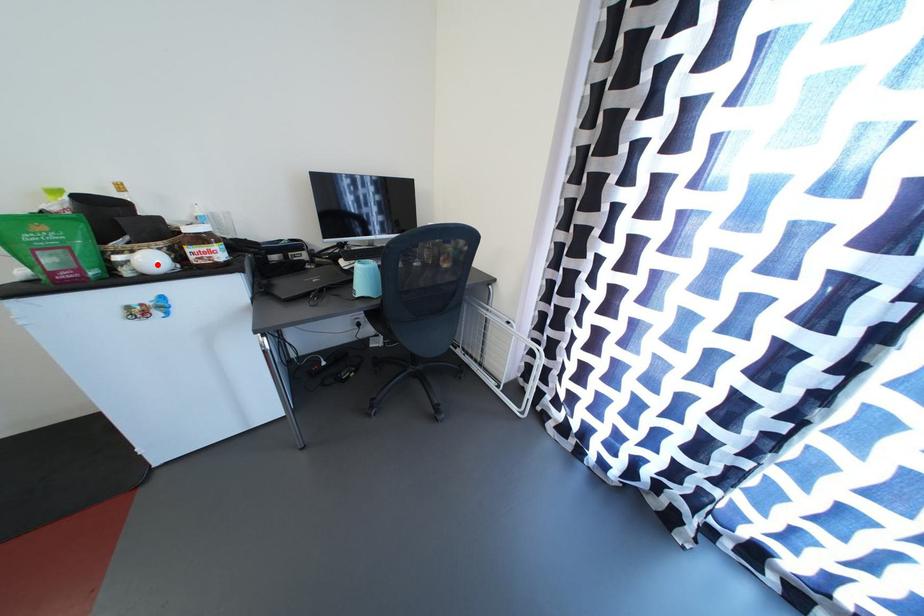
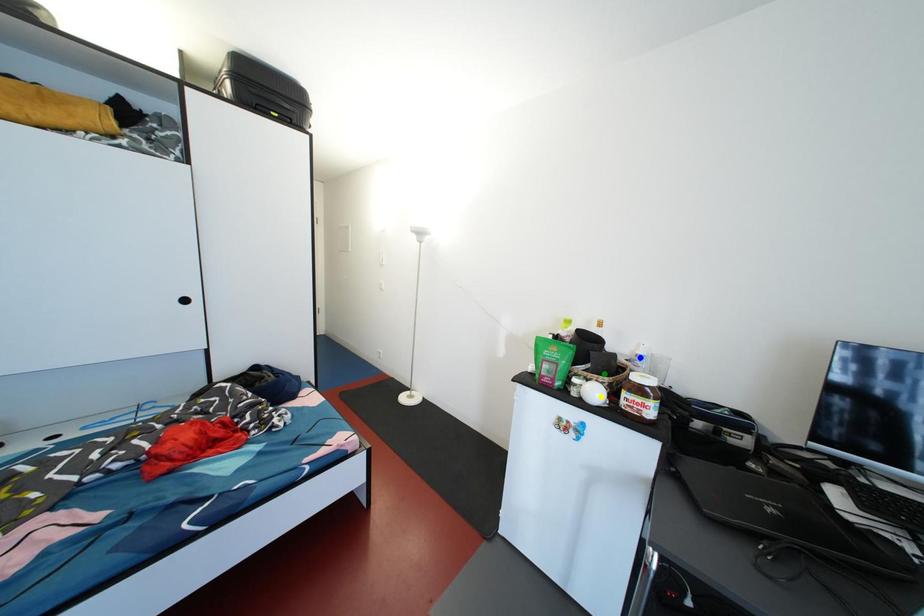
Question: I am providing you with two images of the same scene from different viewpoints. A red point is marked on the first image. You are given multiple points on the second image. Which point in image 2 represents the same 3d spot as the red point in image 1?

Choices:
 (A) blue point
 (B) yellow point
 (C) green point

Answer: (B)